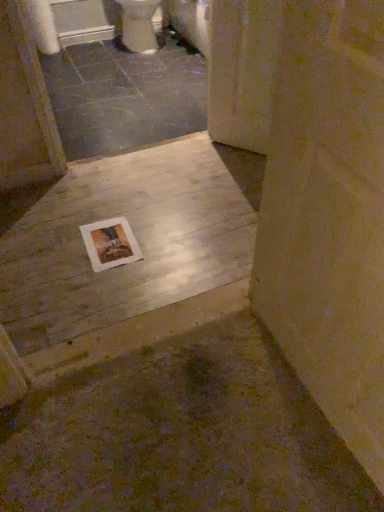
Image resolution: width=384 pixels, height=512 pixels. Identify the location of vacant area that is in front of white paper at center. (104, 288).